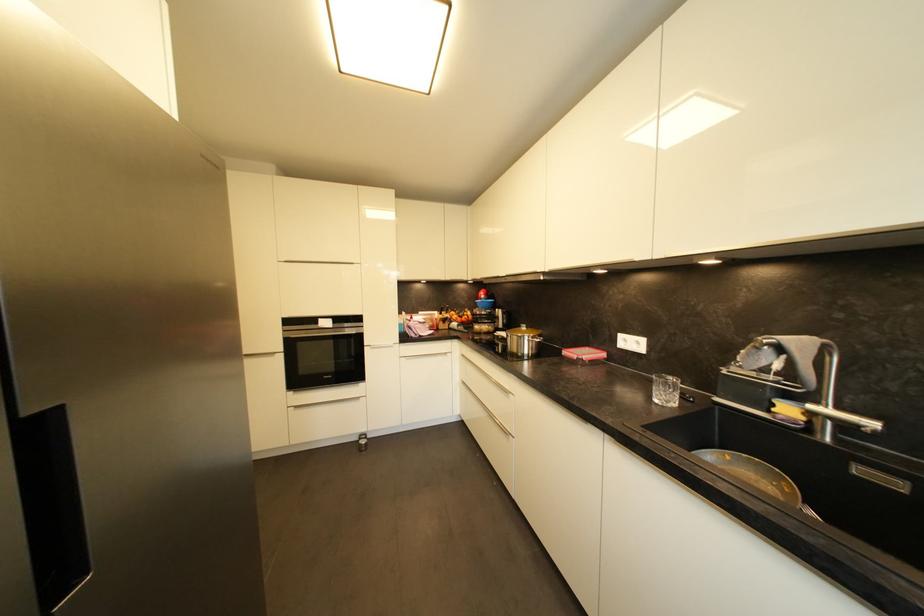
Locate an element on the screen. The width and height of the screenshot is (924, 616). white power socket is located at coordinates (631, 342).